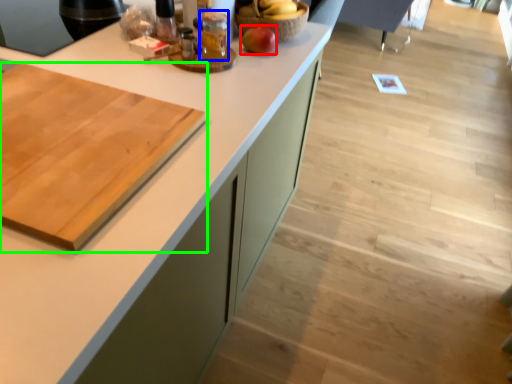
Question: Based on their relative distances, which object is farther from apple (highlighted by a red box)? Choose from beverage (highlighted by a blue box) and cutting board (highlighted by a green box).

Choices:
 (A) beverage
 (B) cutting board

Answer: (B)